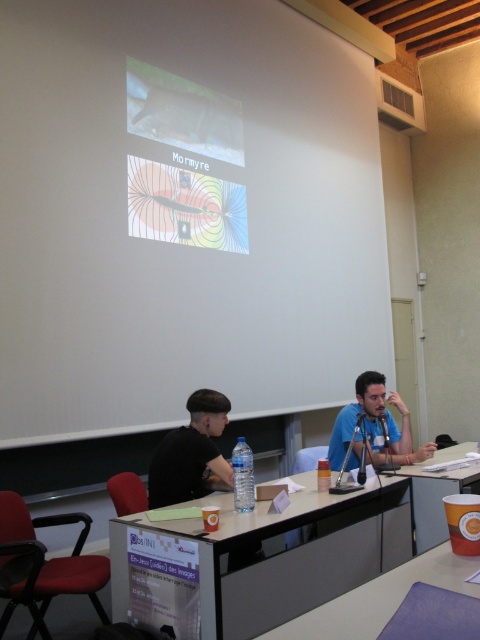
Question: Which object is farther from the camera taking this photo?

Choices:
 (A) purple matte table at center
 (B) blue matte shirt at center
 (C) black matte shirt at lower left
 (D) black glossy table at center

Answer: (B)

Question: Which of the following is the farthest from the observer?

Choices:
 (A) black glossy table at center
 (B) orange paper cup at lower right

Answer: (B)

Question: Does black glossy table at center come in front of black matte shirt at lower left?

Choices:
 (A) no
 (B) yes

Answer: (B)

Question: Which object is the closest to the black glossy table at center?

Choices:
 (A) purple matte table at center
 (B) black matte shirt at lower left
 (C) matte plastic projector screen at upper center
 (D) blue matte shirt at center

Answer: (B)

Question: Does purple matte table at center appear on the left side of blue matte shirt at center?

Choices:
 (A) yes
 (B) no

Answer: (A)

Question: Does matte plastic projector screen at upper center appear on the right side of purple matte table at center?

Choices:
 (A) no
 (B) yes

Answer: (A)